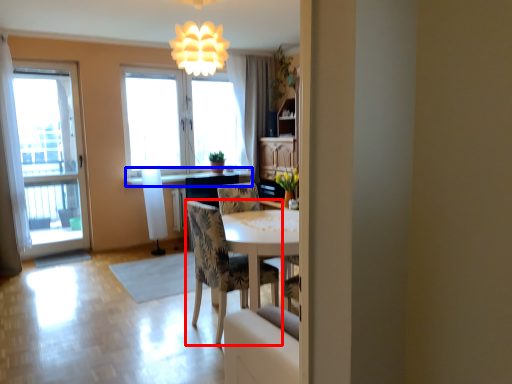
Question: Which point is closer to the camera, chair (highlighted by a red box) or counter top (highlighted by a blue box)?

Choices:
 (A) chair
 (B) counter top

Answer: (A)